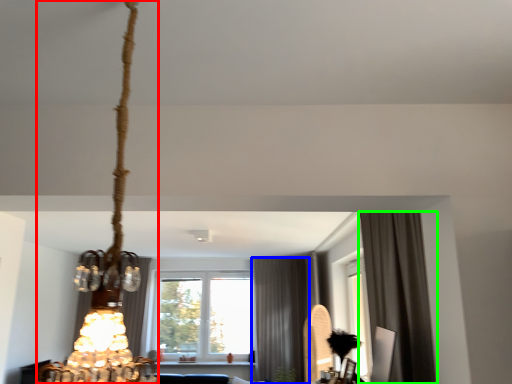
Question: Which object is the farthest from lamp (highlighted by a red box)? Choose among these: curtain (highlighted by a blue box) or curtain (highlighted by a green box).

Choices:
 (A) curtain
 (B) curtain

Answer: (A)